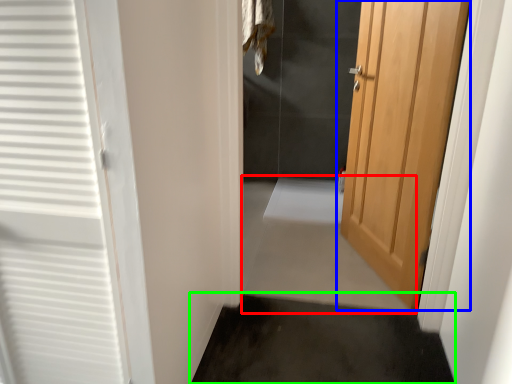
Question: Which is farther away from path (highlighted by a red box)? door (highlighted by a blue box) or path (highlighted by a green box)?

Choices:
 (A) door
 (B) path

Answer: (A)